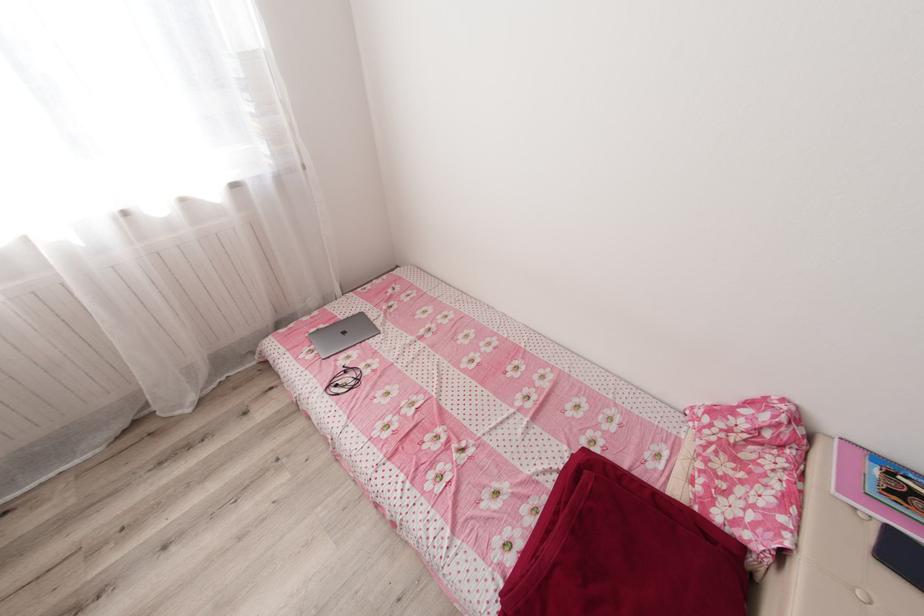
The location [344,381] corresponds to which object?

It corresponds to the black earphones in the image.